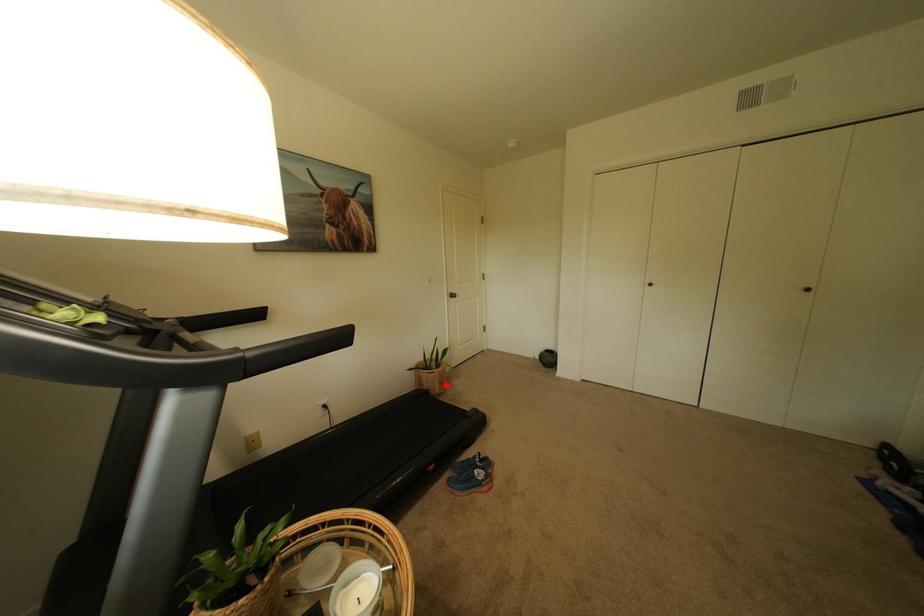
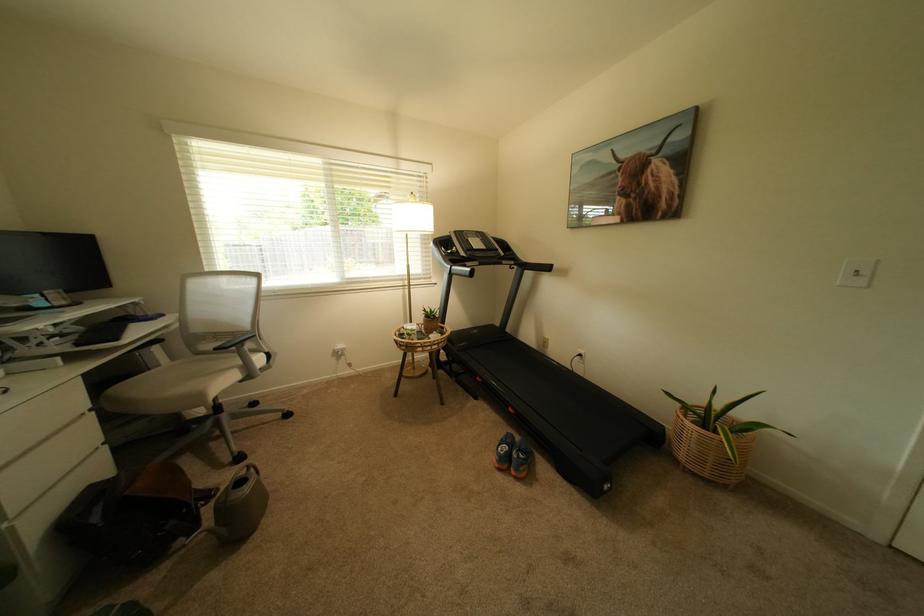
Locate, in the second image, the point that corresponds to the highlighted location in the first image.

(695, 448)